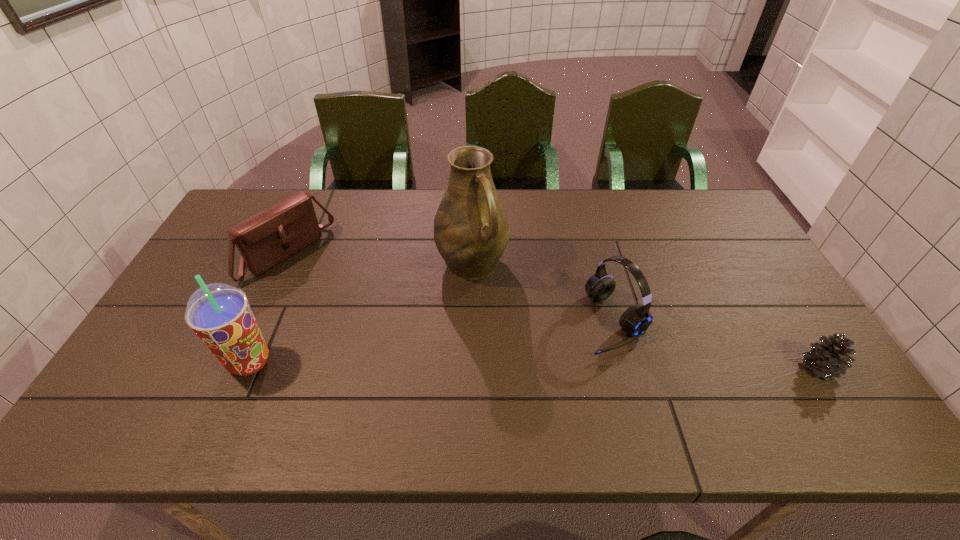
Where is `free space that satisfies the following two spatial constraints: 1. on the front side of the fourth object from left to right; 2. on the right side of the shoulder bag`? free space that satisfies the following two spatial constraints: 1. on the front side of the fourth object from left to right; 2. on the right side of the shoulder bag is located at coordinates (257, 321).